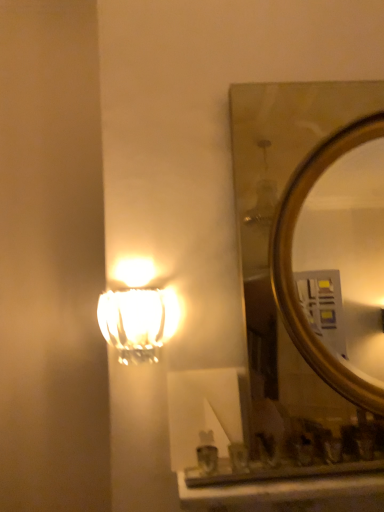
Describe the element at coordinates (312, 271) in the screenshot. I see `gold metallic mirror at upper right` at that location.

The image size is (384, 512). I want to click on gold metallic mirror at upper right, so click(312, 271).

Describe the element at coordinates (137, 322) in the screenshot. The height and width of the screenshot is (512, 384). I see `translucent glass lamp at upper left` at that location.

What is the approximate height of translucent glass lamp at upper left?

translucent glass lamp at upper left is 10.59 inches tall.

I want to click on translucent glass lamp at upper left, so click(137, 322).

This screenshot has width=384, height=512. In order to click on gold metallic mirror at upper right in this screenshot , I will do `click(312, 271)`.

Based on the photo, can you confirm if gold metallic mirror at upper right is positioned to the right of translucent glass lamp at upper left?

Correct, you'll find gold metallic mirror at upper right to the right of translucent glass lamp at upper left.

Which object is more forward, gold metallic mirror at upper right or translucent glass lamp at upper left?

translucent glass lamp at upper left is closer to the camera.

Does point (272, 175) come closer to viewer compared to point (142, 296)?

No, (272, 175) is further to viewer.

From the image's perspective, does gold metallic mirror at upper right appear lower than translucent glass lamp at upper left?

Incorrect, from the image's perspective, gold metallic mirror at upper right is higher than translucent glass lamp at upper left.

From a real-world perspective, does gold metallic mirror at upper right sit lower than translucent glass lamp at upper left?

No.

Is gold metallic mirror at upper right wider than translucent glass lamp at upper left?

Yes, gold metallic mirror at upper right is wider than translucent glass lamp at upper left.

Considering the relative sizes of gold metallic mirror at upper right and translucent glass lamp at upper left in the image provided, is gold metallic mirror at upper right shorter than translucent glass lamp at upper left?

No, gold metallic mirror at upper right is not shorter than translucent glass lamp at upper left.

Looking at this image, which of these two, gold metallic mirror at upper right or translucent glass lamp at upper left, is smaller?

translucent glass lamp at upper left.

Is gold metallic mirror at upper right inside the boundaries of translucent glass lamp at upper left, or outside?

gold metallic mirror at upper right is spatially situated outside translucent glass lamp at upper left.

Is gold metallic mirror at upper right far from translucent glass lamp at upper left?

gold metallic mirror at upper right is positioned a significant distance from translucent glass lamp at upper left.

Could you tell me if gold metallic mirror at upper right is facing translucent glass lamp at upper left?

No, gold metallic mirror at upper right is not facing towards translucent glass lamp at upper left.

How many degrees apart are the facing directions of gold metallic mirror at upper right and translucent glass lamp at upper left?

0.00396 degrees.

Locate an element on the screen. lamp on the left side of gold metallic mirror at upper right is located at coordinates (137, 322).

Does translucent glass lamp at upper left appear on the right side of gold metallic mirror at upper right?

No, translucent glass lamp at upper left is not to the right of gold metallic mirror at upper right.

Which object is closer to the camera taking this photo, translucent glass lamp at upper left or gold metallic mirror at upper right?

translucent glass lamp at upper left is closer to the camera.

Is point (136, 319) closer or farther from the camera than point (336, 102)?

Point (136, 319) appears to be closer to the viewer than point (336, 102).

From the image's perspective, is translucent glass lamp at upper left below gold metallic mirror at upper right?

Yes, from the image's perspective, translucent glass lamp at upper left is beneath gold metallic mirror at upper right.

From a real-world perspective, is translucent glass lamp at upper left over gold metallic mirror at upper right?

No.

From the picture: Which object is wider, translucent glass lamp at upper left or gold metallic mirror at upper right?

gold metallic mirror at upper right is wider.

In the scene shown: Which of these two, translucent glass lamp at upper left or gold metallic mirror at upper right, stands taller?

With more height is gold metallic mirror at upper right.

Who is smaller, translucent glass lamp at upper left or gold metallic mirror at upper right?

translucent glass lamp at upper left.

Is translucent glass lamp at upper left not within gold metallic mirror at upper right?

translucent glass lamp at upper left lies outside gold metallic mirror at upper right's area.

Is translucent glass lamp at upper left not near gold metallic mirror at upper right?

That's right, there is a large distance between translucent glass lamp at upper left and gold metallic mirror at upper right.

Is translucent glass lamp at upper left oriented away from gold metallic mirror at upper right?

No, gold metallic mirror at upper right is not at the back of translucent glass lamp at upper left.

What's the angular difference between translucent glass lamp at upper left and gold metallic mirror at upper right's facing directions?

They differ by 0.00396 degrees in their facing directions.

Find the location of `lamp that appears below the gold metallic mirror at upper right (from the image's perspective)`. lamp that appears below the gold metallic mirror at upper right (from the image's perspective) is located at coordinates (137, 322).

The image size is (384, 512). I want to click on mirror above the translucent glass lamp at upper left (from the image's perspective), so click(312, 271).

Where is `lamp lying in front of the gold metallic mirror at upper right`? Image resolution: width=384 pixels, height=512 pixels. lamp lying in front of the gold metallic mirror at upper right is located at coordinates (137, 322).